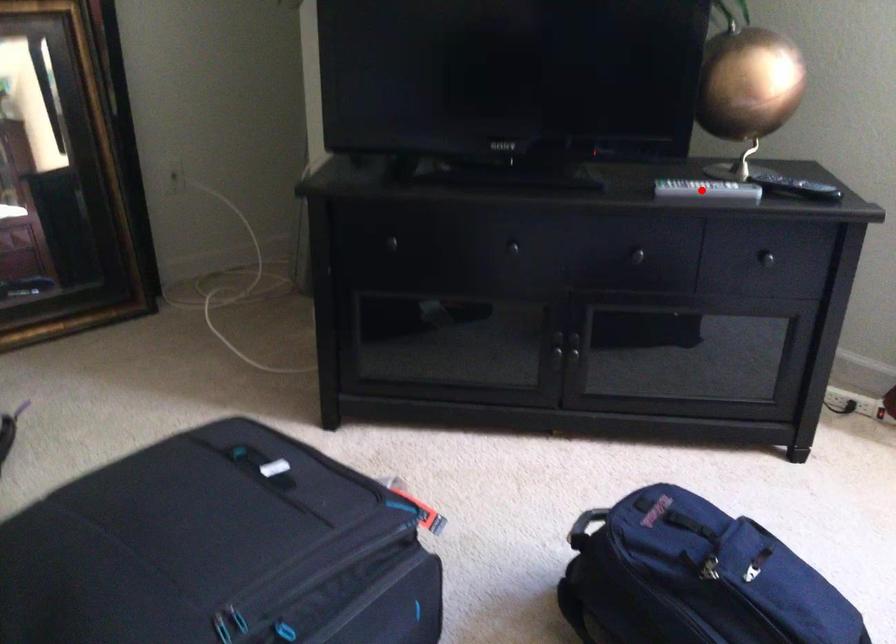
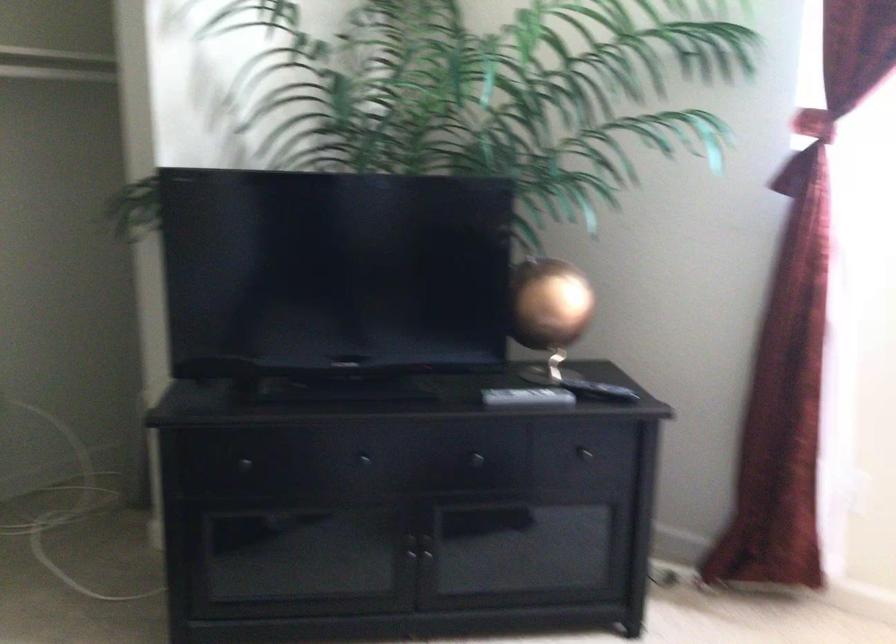
Question: I am providing you with two images of the same scene from different viewpoints. A red point is marked on the first image. Is the red point's position out of view in image 2?

Choices:
 (A) Yes
 (B) No

Answer: (B)